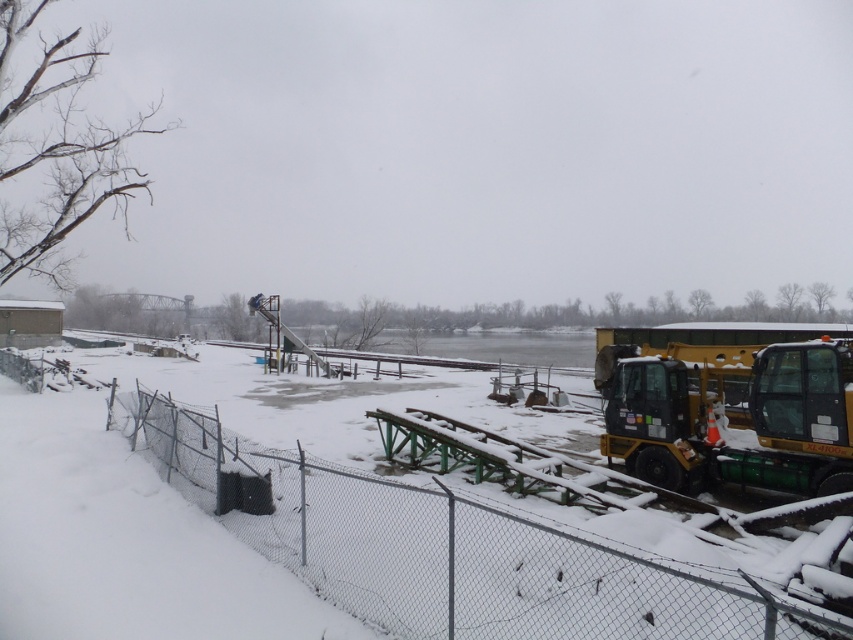
You are a delivery driver who needs to back up your truck to load some equipment. You see the wire mesh fence at lower left and the yellow rubber plow at right. Which object is narrower so you can avoid hitting it while maneuvering?

The wire mesh fence at lower left is thinner than the yellow rubber plow at right, so you should avoid hitting the narrower wire mesh fence at lower left while maneuvering.

You are a delivery driver who needs to back up your truck to load some equipment. You see the wire mesh fence at lower left and the yellow rubber plow at right. Which object should you avoid hitting when backing up?

You should avoid hitting the wire mesh fence at lower left because it is positioned on the left side of the yellow rubber plow at right, meaning it is closer to your truck when backing up.